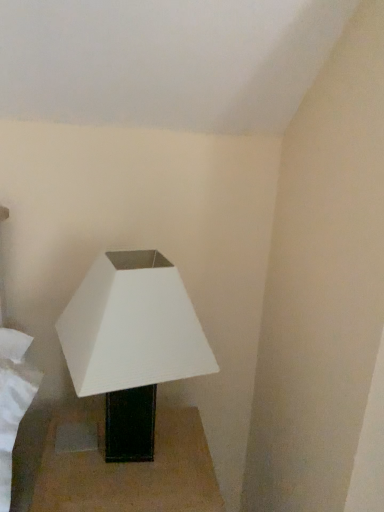
Question: Considering the positions of black glossy table at lower center and white matte lamp at lower left in the image, is black glossy table at lower center wider or thinner than white matte lamp at lower left?

Choices:
 (A) thin
 (B) wide

Answer: (B)

Question: Choose the correct answer: Is black glossy table at lower center inside white matte lamp at lower left or outside it?

Choices:
 (A) outside
 (B) inside

Answer: (A)

Question: Is black glossy table at lower center taller or shorter than white matte lamp at lower left?

Choices:
 (A) tall
 (B) short

Answer: (B)

Question: Is white matte lamp at lower left in front of or behind black glossy table at lower center in the image?

Choices:
 (A) behind
 (B) front

Answer: (B)

Question: In terms of height, does white matte lamp at lower left look taller or shorter compared to black glossy table at lower center?

Choices:
 (A) short
 (B) tall

Answer: (B)

Question: Choose the correct answer: Is white matte lamp at lower left inside black glossy table at lower center or outside it?

Choices:
 (A) inside
 (B) outside

Answer: (B)

Question: From the image's perspective, is white matte lamp at lower left above or below black glossy table at lower center?

Choices:
 (A) below
 (B) above

Answer: (B)